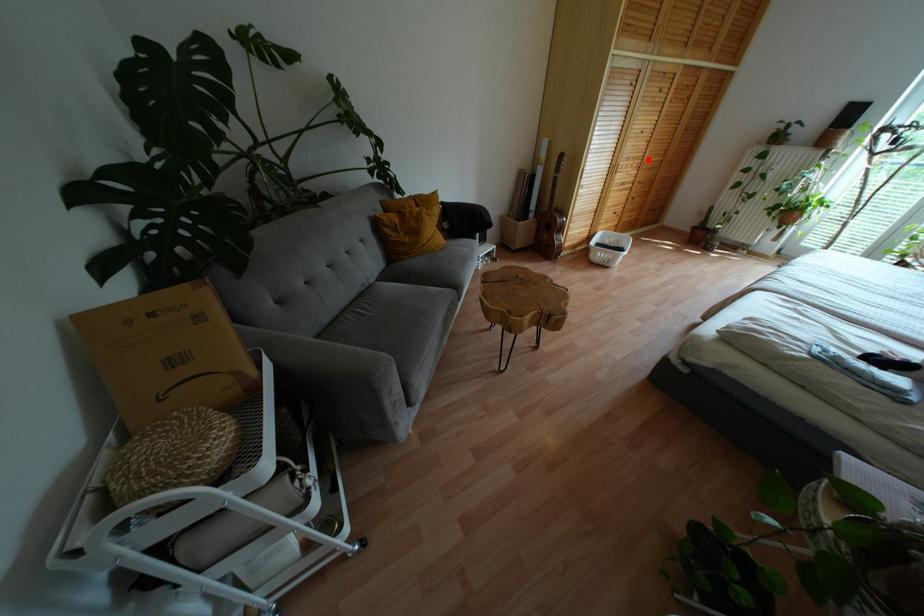
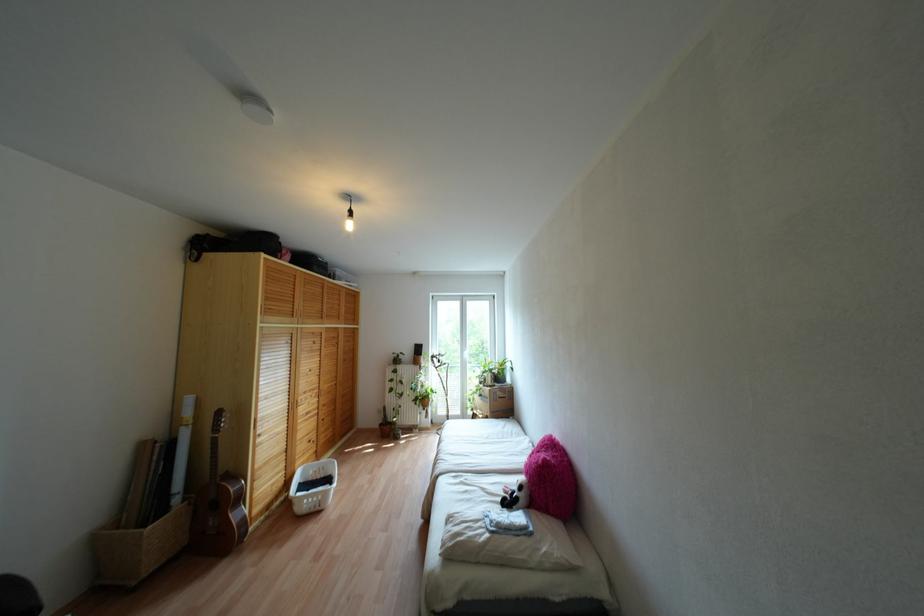
Where in the second image is the point corresponding to the highlighted location from the first image?

(324, 387)